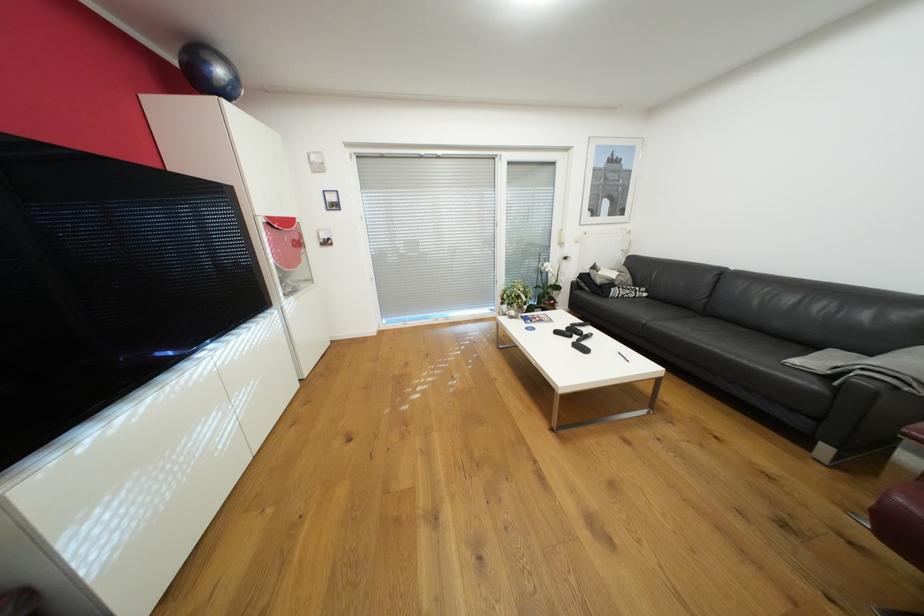
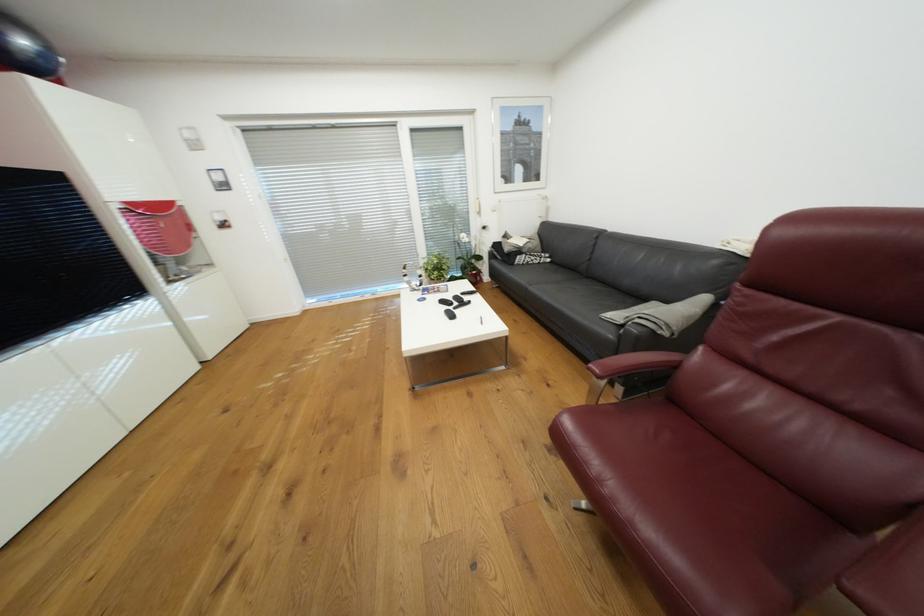
Locate, in the second image, the point that corresponds to point 324,168 in the first image.

(201, 145)